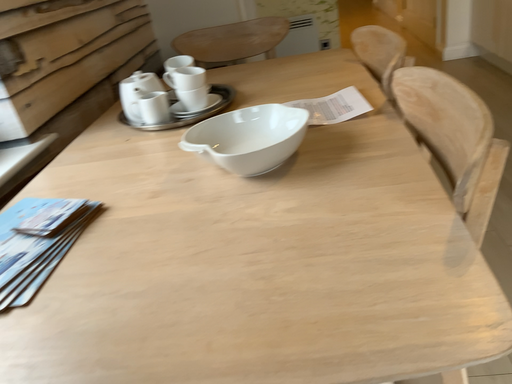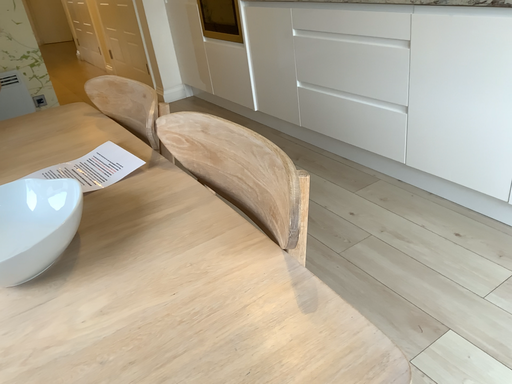
Question: Which way did the camera rotate in the video?

Choices:
 (A) rotated left
 (B) rotated right

Answer: (B)